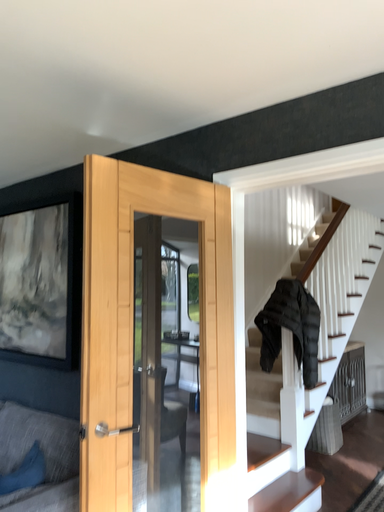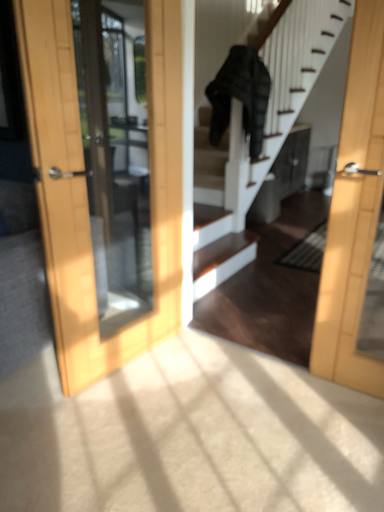
Question: Which way did the camera rotate in the video?

Choices:
 (A) rotated right
 (B) rotated left

Answer: (A)